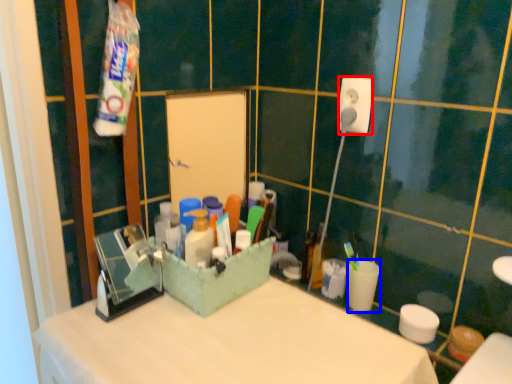
Question: Among these objects, which one is nearest to the camera, power plugs and sockets (highlighted by a red box) or coffee cup (highlighted by a blue box)?

Choices:
 (A) power plugs and sockets
 (B) coffee cup

Answer: (A)